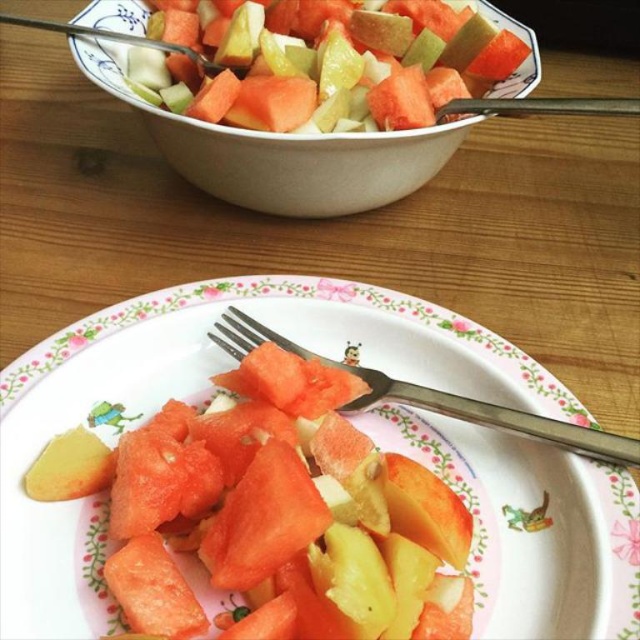
You are standing at the origin point of the image coordinate system. Which object is located at point (x=282, y=152)?

The white ceramic bowl at upper center is located at point (x=282, y=152).

You are a food stylist arranging a photo shoot. You need to place a new decorative item between the white ceramic bowl at upper center and the yellow matte potato at lower left. Considering their heights, which object should the new item be placed closer to?

The white ceramic bowl at upper center is taller than the yellow matte potato at lower left, so the new item should be placed closer to the yellow matte potato at lower left to maintain visual balance.